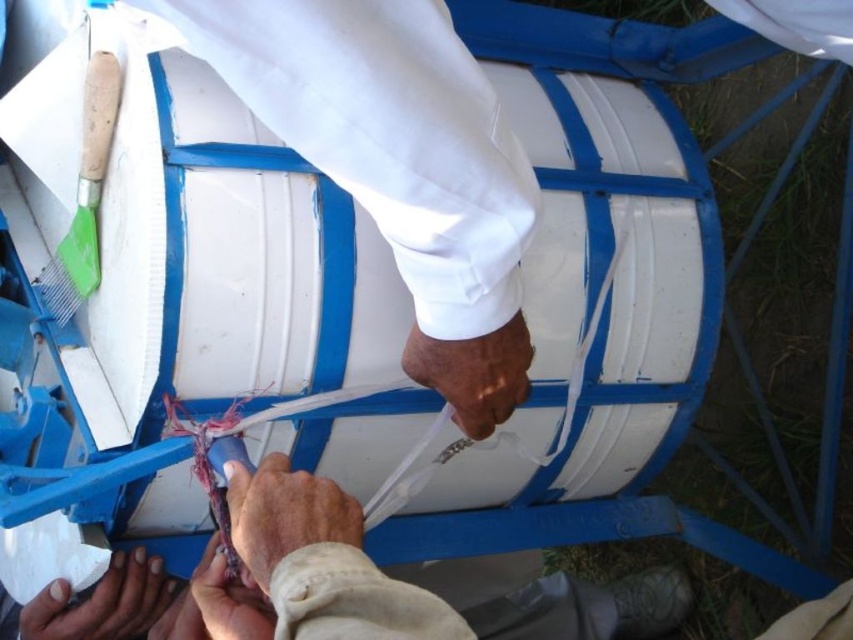
Question: Does leather-like tan hand at center have a smaller size compared to smooth skin hand at lower center?

Choices:
 (A) no
 (B) yes

Answer: (A)

Question: Which of the following is the closest to the observer?

Choices:
 (A) (30, 605)
 (B) (231, 492)

Answer: (B)

Question: Which of the following is the farthest from the observer?

Choices:
 (A) brown matte hand at center
 (B) leather-like tan hand at center
 (C) dirty white hand at lower left
 (D) smooth skin hand at lower center

Answer: (C)

Question: Is the position of leather-like tan hand at center less distant than that of smooth skin hand at lower center?

Choices:
 (A) no
 (B) yes

Answer: (B)

Question: Among these points, which one is farthest from the camera?

Choices:
 (A) (74, 609)
 (B) (335, 484)
 (C) (527, 340)

Answer: (A)

Question: From the image, what is the correct spatial relationship of leather-like tan hand at center in relation to smooth skin hand at lower center?

Choices:
 (A) right
 (B) left

Answer: (A)